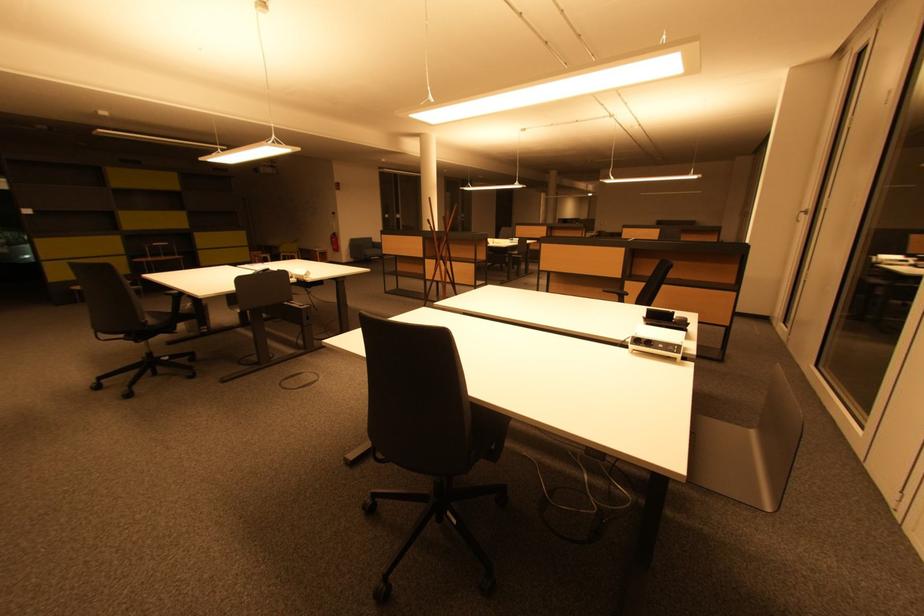
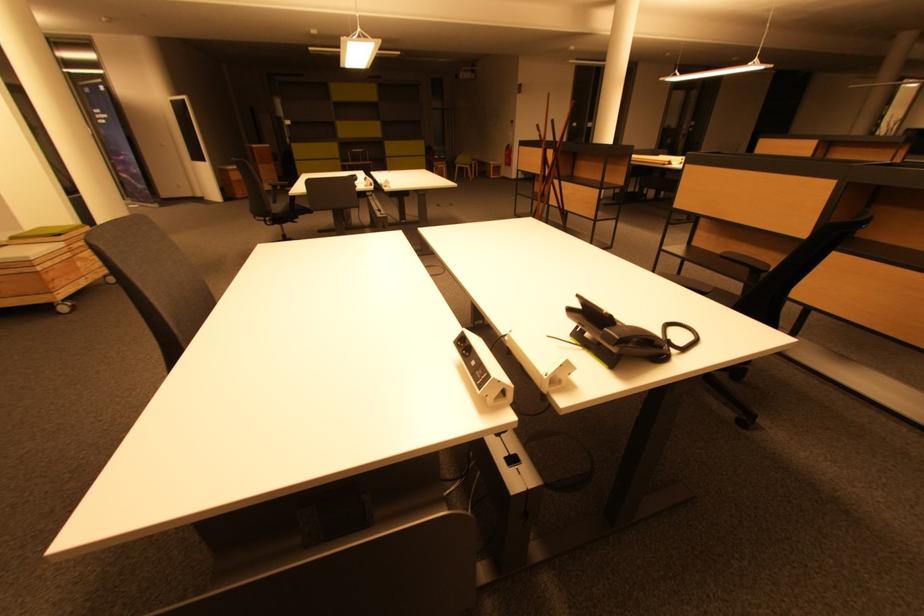
In the second image, find the point that corresponds to (x=338, y=241) in the first image.

(512, 155)